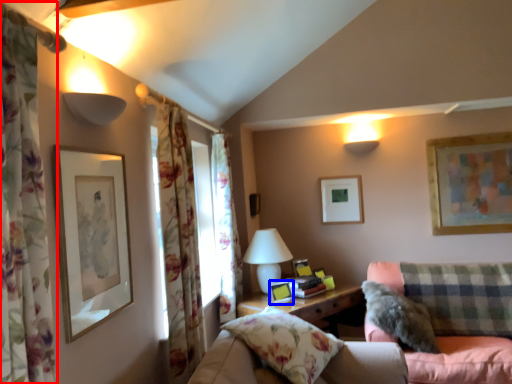
Question: Which point is further to the camera, curtain (highlighted by a red box) or picture frame (highlighted by a blue box)?

Choices:
 (A) curtain
 (B) picture frame

Answer: (B)